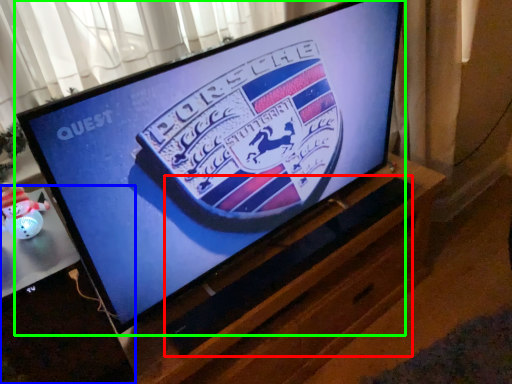
Question: Which is nearer to the speaker (highlighted by a red box)? desktop (highlighted by a blue box) or television (highlighted by a green box).

Choices:
 (A) desktop
 (B) television

Answer: (B)